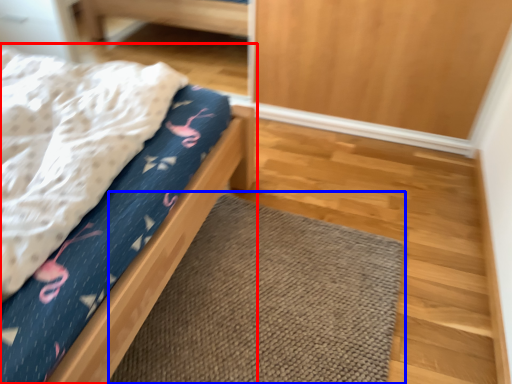
Question: Which of the following is the farthest to the observer, bed (highlighted by a red box) or doormat (highlighted by a blue box)?

Choices:
 (A) bed
 (B) doormat

Answer: (B)